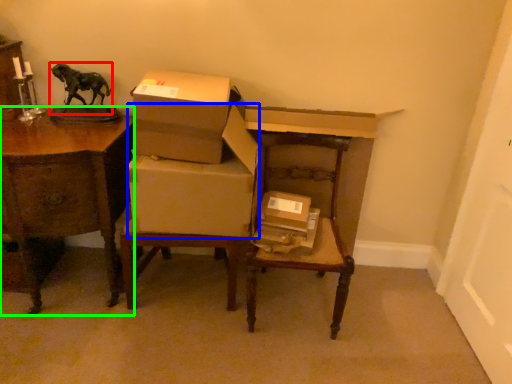
Question: Based on their relative distances, which object is farther from animal (highlighted by a red box)? Choose from cardboard box (highlighted by a blue box) and desk (highlighted by a green box).

Choices:
 (A) cardboard box
 (B) desk

Answer: (A)